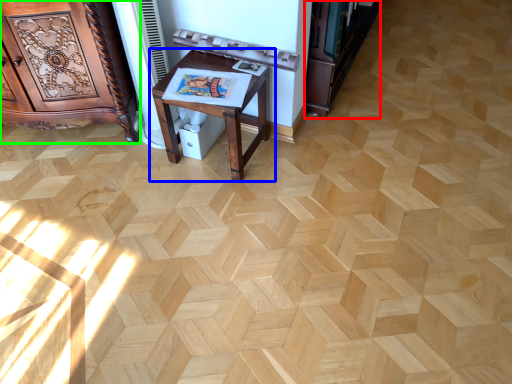
Question: Which object is the closest to the bookshelf (highlighted by a red box)? Choose among these: table (highlighted by a blue box) or furniture (highlighted by a green box).

Choices:
 (A) table
 (B) furniture

Answer: (A)